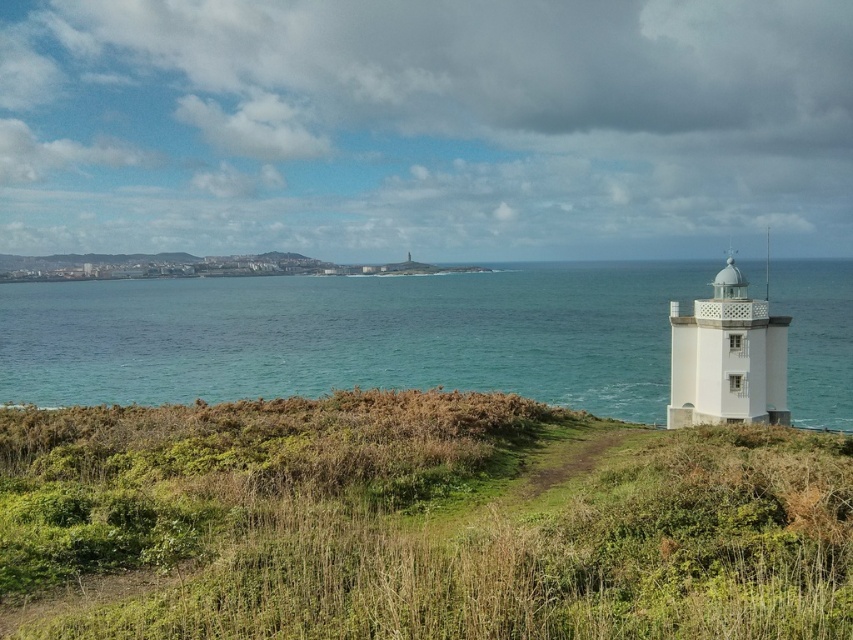
Question: Based on their relative distances, which object is farther from the white matte lighthouse at right?

Choices:
 (A) green grassy at right
 (B) blue water at center

Answer: (B)

Question: Is blue water at center to the right of white matte lighthouse at right from the viewer's perspective?

Choices:
 (A) no
 (B) yes

Answer: (A)

Question: Which point is farther to the camera?

Choices:
 (A) (672, 353)
 (B) (245, 300)

Answer: (B)

Question: Which point is closer to the camera taking this photo?

Choices:
 (A) (387, 605)
 (B) (718, 387)
 (C) (218, 321)

Answer: (A)

Question: Is green grassy at right below white matte lighthouse at right?

Choices:
 (A) no
 (B) yes

Answer: (B)

Question: In this image, where is blue water at center located relative to white matte lighthouse at right?

Choices:
 (A) below
 (B) above

Answer: (B)